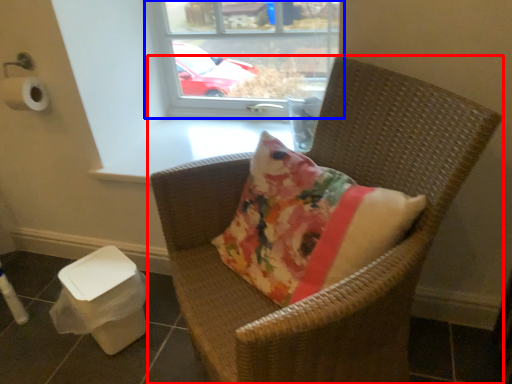
Question: Which of the following is the farthest to the observer, chair (highlighted by a red box) or window (highlighted by a blue box)?

Choices:
 (A) chair
 (B) window

Answer: (B)